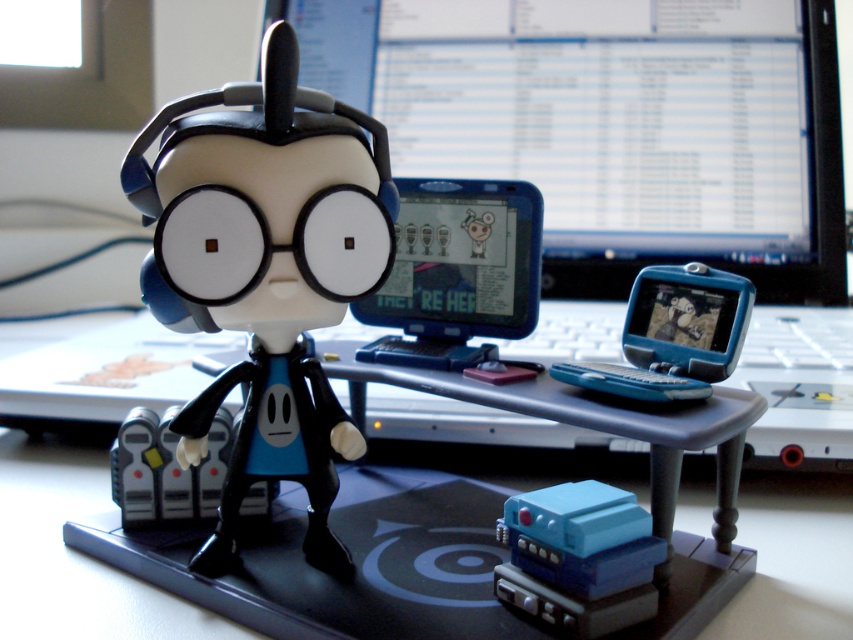
Question: Is blue plastic computer at center further to the viewer compared to matte black figurine at center?

Choices:
 (A) yes
 (B) no

Answer: (A)

Question: Which object is the closest to the blue plastic toy at center?

Choices:
 (A) blue plastic speaker at lower center
 (B) black plastic computer desk at center
 (C) blue plastic computer at center
 (D) matte black figurine at center

Answer: (A)

Question: Which object is farther from the camera taking this photo?

Choices:
 (A) matte black figurine at center
 (B) white matte robot at center
 (C) black plastic computer desk at center
 (D) blue plastic computer at center

Answer: (D)

Question: Is blue plastic speaker at lower center below white matte robot at center?

Choices:
 (A) no
 (B) yes

Answer: (B)

Question: Is blue plastic speaker at lower center to the right of white matte robot at center from the viewer's perspective?

Choices:
 (A) yes
 (B) no

Answer: (A)

Question: Estimate the real-world distances between objects in this image. Which object is closer to the white matte robot at center?

Choices:
 (A) blue plastic toy at center
 (B) black plastic computer desk at center

Answer: (B)